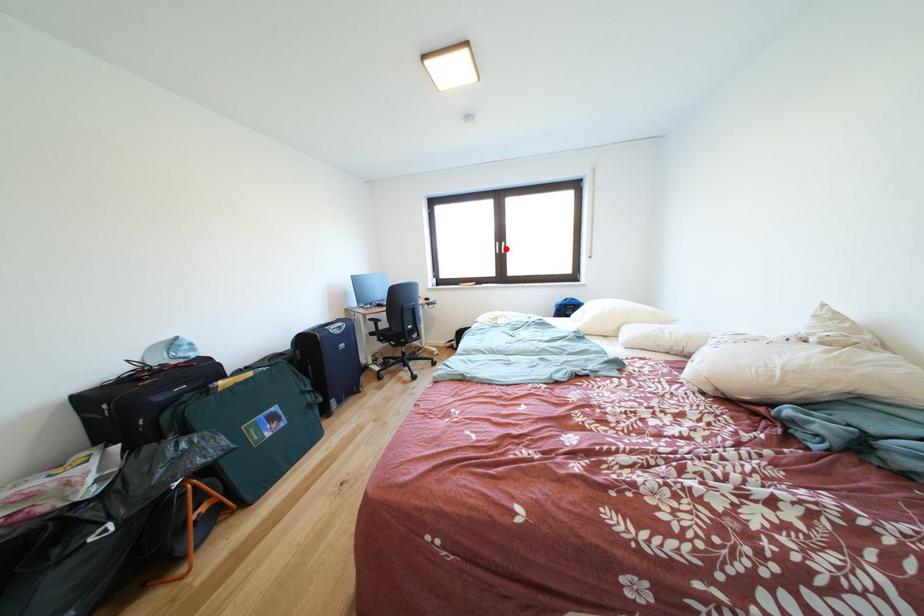
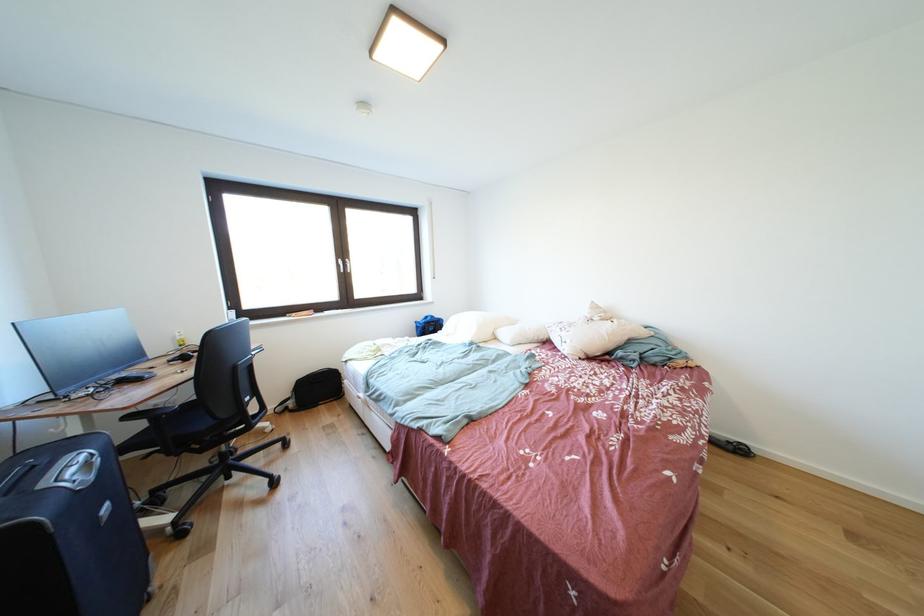
The point at the highlighted location is marked in the first image. Where is the corresponding point in the second image?

(348, 265)